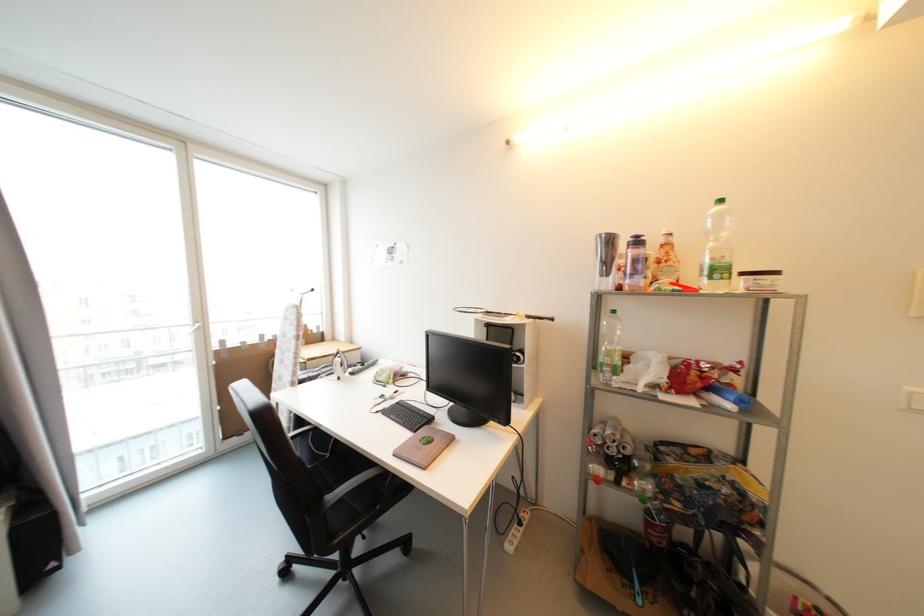
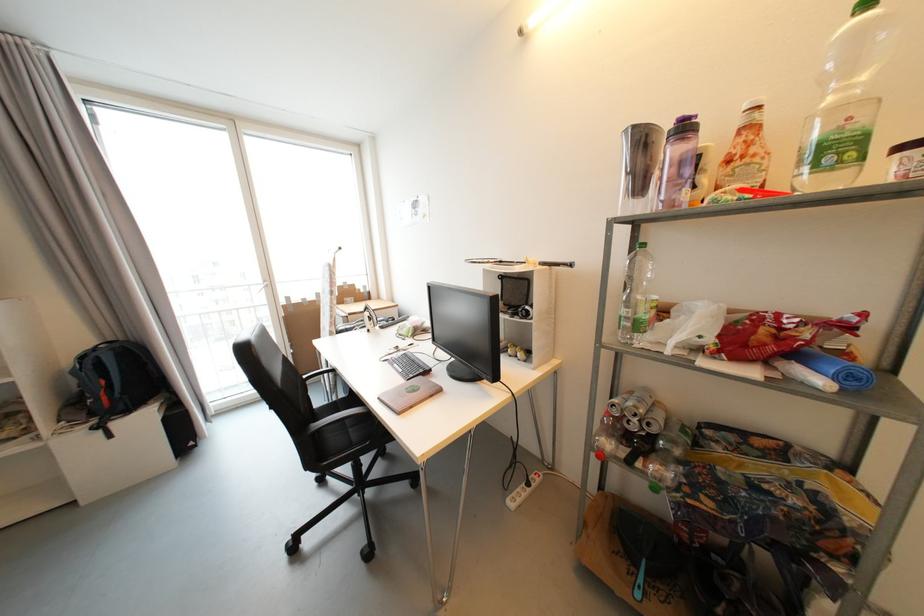
Locate, in the second image, the point that corresponds to the point at 642,244 in the first image.

(689, 130)